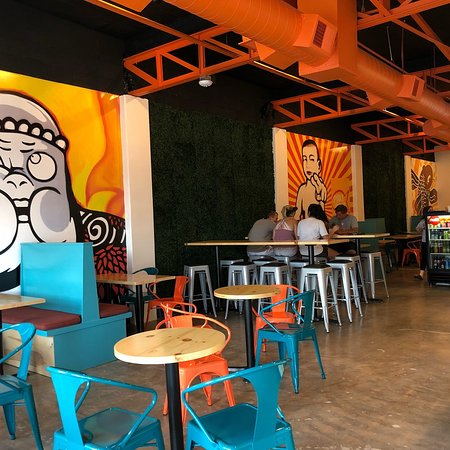
Where is `blue chair`? The height and width of the screenshot is (450, 450). blue chair is located at coordinates (104, 429), (226, 427), (284, 341), (15, 389).